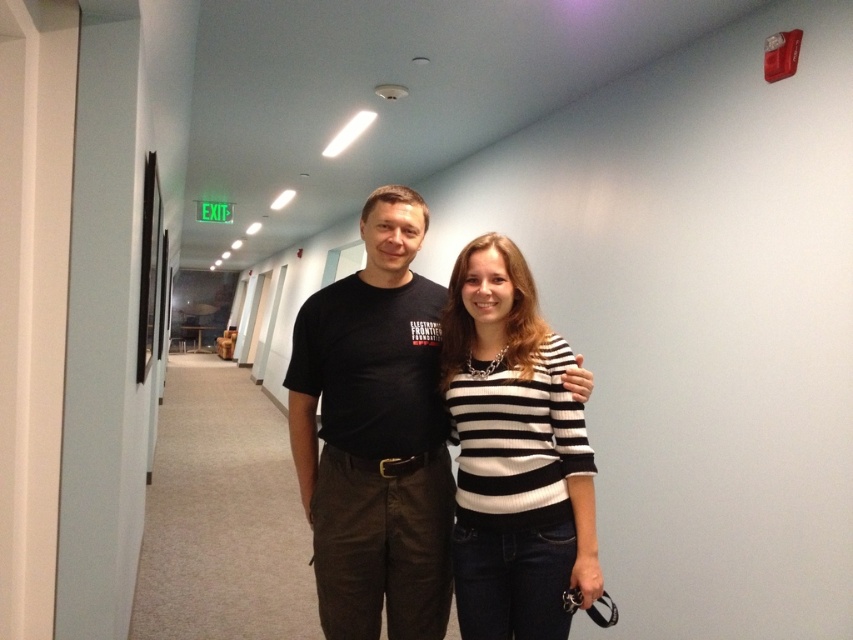
Question: Is black cotton shirt at center thinner than black and white striped sweater at center?

Choices:
 (A) yes
 (B) no

Answer: (B)

Question: Is black cotton shirt at center positioned at the back of black and white striped sweater at center?

Choices:
 (A) no
 (B) yes

Answer: (B)

Question: Can you confirm if black cotton shirt at center is bigger than black and white striped sweater at center?

Choices:
 (A) yes
 (B) no

Answer: (A)